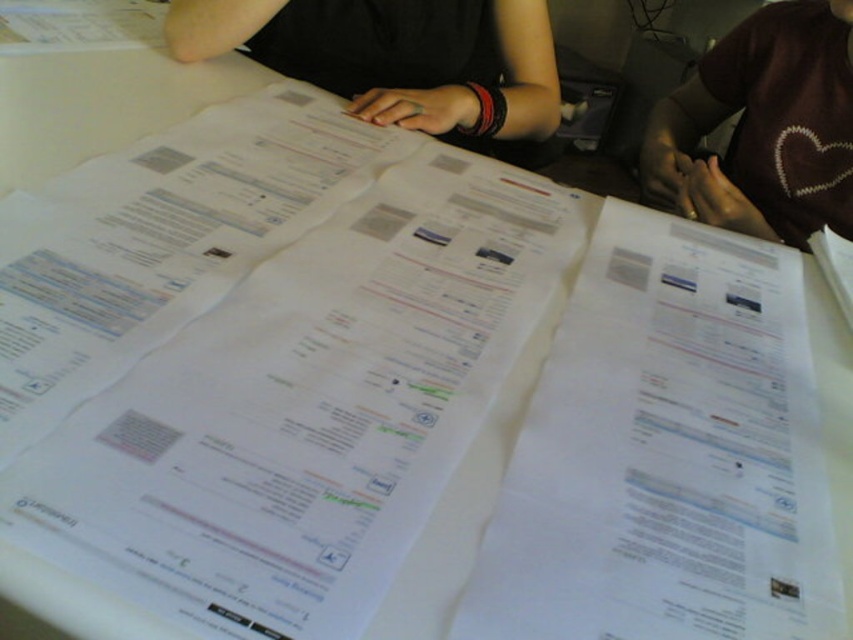
Question: Where is white paper at center located in relation to brown heart-patterned shirt at upper right in the image?

Choices:
 (A) below
 (B) above

Answer: (A)

Question: Among these points, which one is nearest to the camera?

Choices:
 (A) (x=645, y=172)
 (B) (x=445, y=19)
 (C) (x=799, y=387)

Answer: (C)

Question: Can you confirm if black fabric at center is thinner than brown heart-patterned shirt at upper right?

Choices:
 (A) no
 (B) yes

Answer: (A)

Question: Where is white paper at center located in relation to brown heart-patterned shirt at upper right in the image?

Choices:
 (A) left
 (B) right

Answer: (A)

Question: Which of the following is the closest to the observer?

Choices:
 (A) (694, 234)
 (B) (442, 84)
 (C) (686, 81)

Answer: (A)

Question: Which of the following is the closest to the observer?

Choices:
 (A) (747, 316)
 (B) (471, 42)
 (C) (695, 192)

Answer: (A)